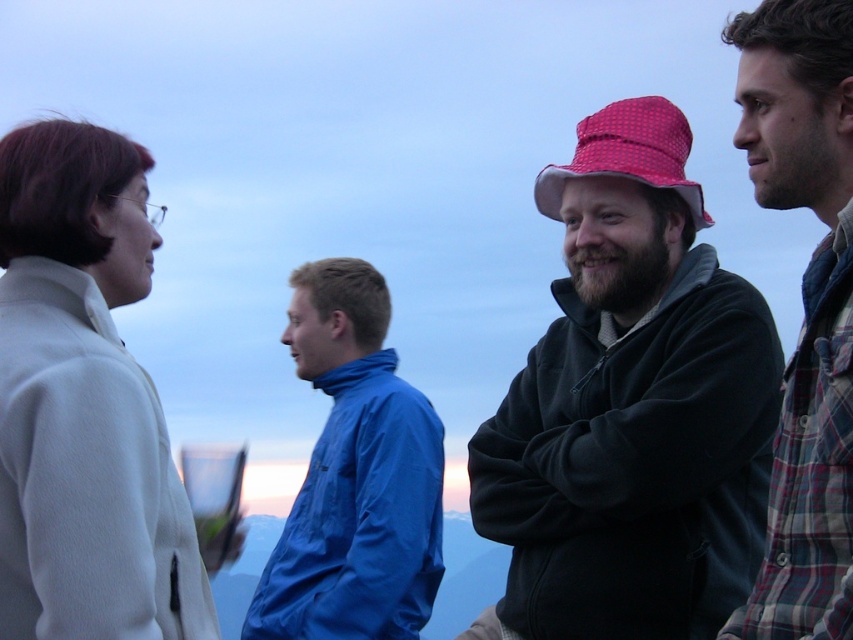
Question: Can you confirm if matte black jacket at center is bigger than blue smooth jacket at center?

Choices:
 (A) yes
 (B) no

Answer: (A)

Question: Which point is closer to the camera?

Choices:
 (A) (88, 317)
 (B) (577, 429)
 (C) (409, 611)
 (D) (643, 173)

Answer: (A)

Question: Considering the relative positions of matte black jacket at center and white fleece jacket at left in the image provided, where is matte black jacket at center located with respect to white fleece jacket at left?

Choices:
 (A) right
 (B) left

Answer: (A)

Question: Is white fleece jacket at left positioned at the back of plaid flannel shirt at right?

Choices:
 (A) no
 (B) yes

Answer: (B)

Question: Among these points, which one is farthest from the camera?

Choices:
 (A) (816, 77)
 (B) (173, 506)
 (C) (332, 330)

Answer: (C)

Question: Which point appears closest to the camera in this image?

Choices:
 (A) (769, 513)
 (B) (343, 320)

Answer: (A)